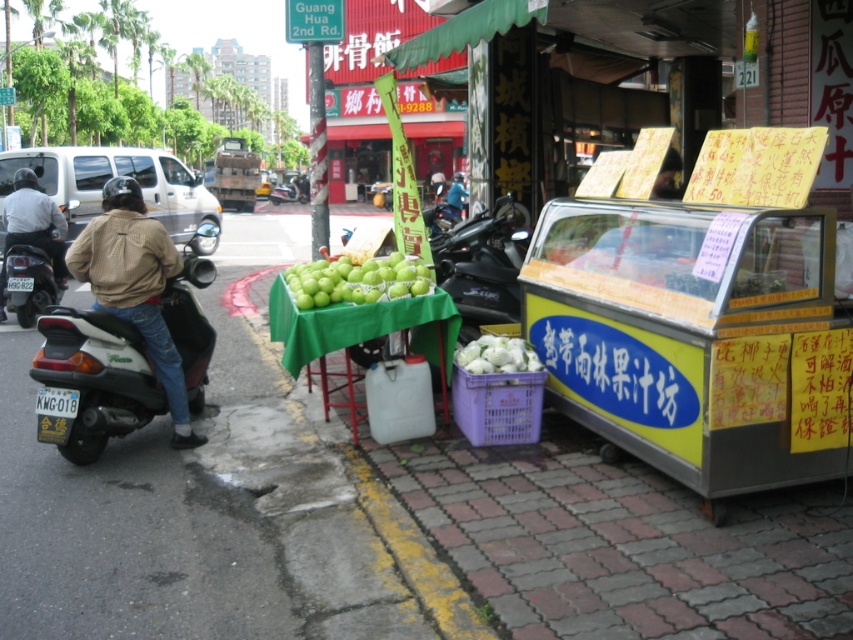
Question: Where is white plastic bag at center located in relation to brown leather jacket at center in the image?

Choices:
 (A) above
 (B) below

Answer: (B)

Question: Does white glossy scooter at left come behind brown leather jacket at center?

Choices:
 (A) yes
 (B) no

Answer: (B)

Question: Which is nearer to the green matte apples at center?

Choices:
 (A) brown leather jacket at center
 (B) white glossy scooter at left
 (C) matte black scooter at left

Answer: (B)

Question: Considering the real-world distances, which object is closest to the matte black scooter at left?

Choices:
 (A) green matte apples at center
 (B) white plastic bag at center
 (C) brown leather jacket at center

Answer: (A)

Question: Which point is closer to the camera?

Choices:
 (A) (450, 186)
 (B) (6, 284)
 (C) (463, 368)

Answer: (C)

Question: Is white glossy scooter at left above brown leather jacket at center?

Choices:
 (A) no
 (B) yes

Answer: (A)